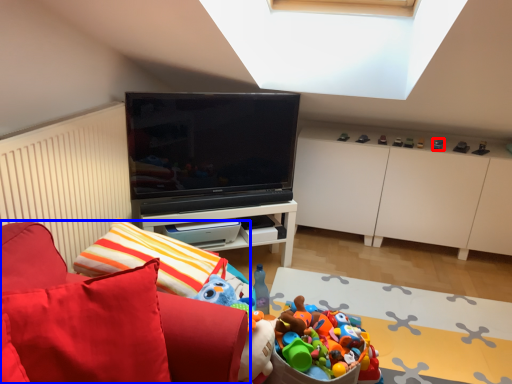
Question: Which object appears closest to the camera in this image, toy (highlighted by a red box) or furniture (highlighted by a blue box)?

Choices:
 (A) toy
 (B) furniture

Answer: (B)